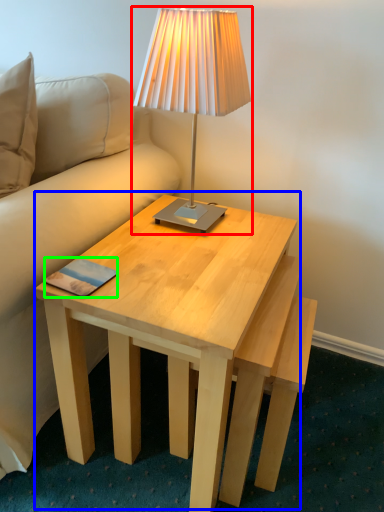
Question: Considering the real-world distances, which object is farthest from lamp (highlighted by a red box)? coffee table (highlighted by a blue box) or pad (highlighted by a green box)?

Choices:
 (A) coffee table
 (B) pad

Answer: (B)